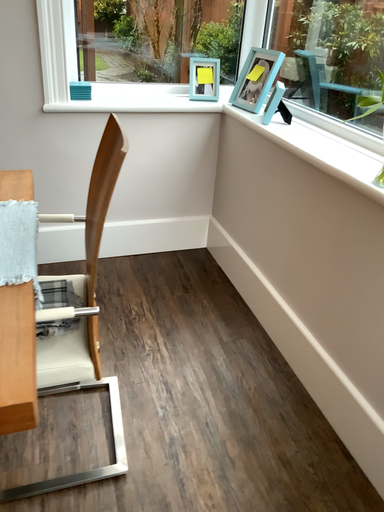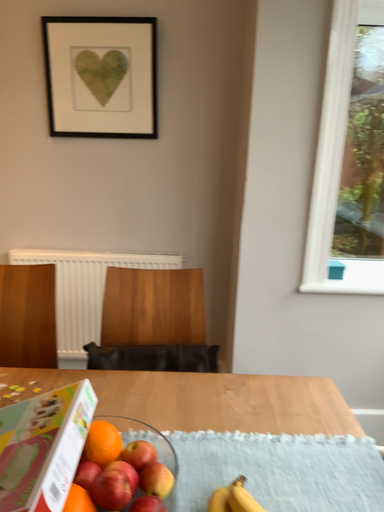
Question: How did the camera likely rotate when shooting the video?

Choices:
 (A) rotated upward
 (B) rotated downward

Answer: (A)